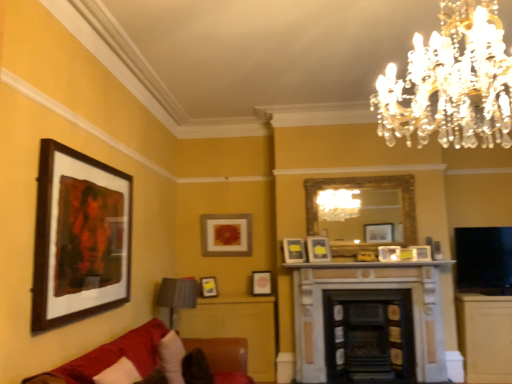
The height and width of the screenshot is (384, 512). I want to click on free space above gold ornate mirror at center (from a real-world perspective), so click(358, 170).